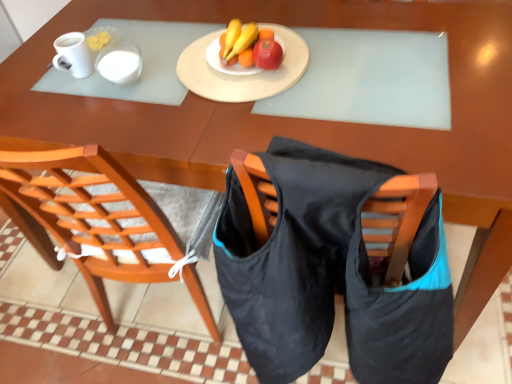
I want to click on vacant space to the left of matte white plate at center, so click(142, 73).